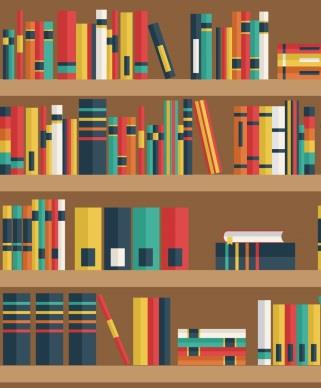
You are a GUI agent. You are given a task and a screenshot of the screen. Output one action in this format:
    pyautogui.click(x=<x>, y=<y>)
    Task: Click on the seven books from the left on the second shelf down from the top
    
    Given the screenshot: What is the action you would take?
    pyautogui.click(x=6, y=133), pyautogui.click(x=17, y=133), pyautogui.click(x=32, y=132), pyautogui.click(x=42, y=134), pyautogui.click(x=48, y=135), pyautogui.click(x=57, y=134), pyautogui.click(x=66, y=137)